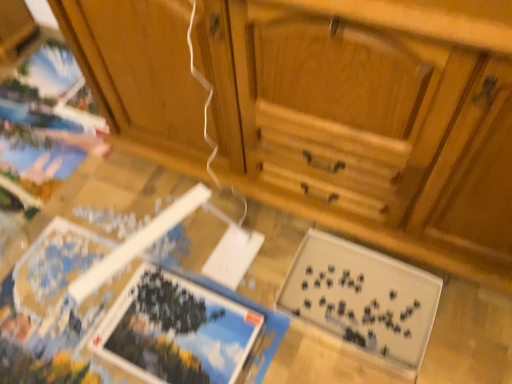
Question: In terms of width, does blue glossy puzzle piece at lower left, the 1th magazine in the left-to-right sequence, look wider or thinner when compared to black matte puzzle pieces at lower right, which is counted as the 1th magazine, starting from the right?

Choices:
 (A) thin
 (B) wide

Answer: (A)

Question: Considering the positions of point (174, 279) and point (387, 314), is point (174, 279) closer or farther from the camera than point (387, 314)?

Choices:
 (A) closer
 (B) farther

Answer: (B)

Question: Which is nearer to the black matte puzzle pieces at lower right, which ranks as the second magazine in left-to-right order?

Choices:
 (A) blue glossy puzzle piece at lower left, the 1th magazine in the left-to-right sequence
 (B) wooden cabinet at center
 (C) wooden puzzle pieces at lower center

Answer: (C)

Question: Based on their relative distances, which object is nearer to the black matte puzzle pieces at lower right, which is counted as the 1th magazine, starting from the right?

Choices:
 (A) wooden cabinet at center
 (B) wooden puzzle pieces at lower center
 (C) blue glossy puzzle piece at lower left, the 1th magazine in the left-to-right sequence

Answer: (B)